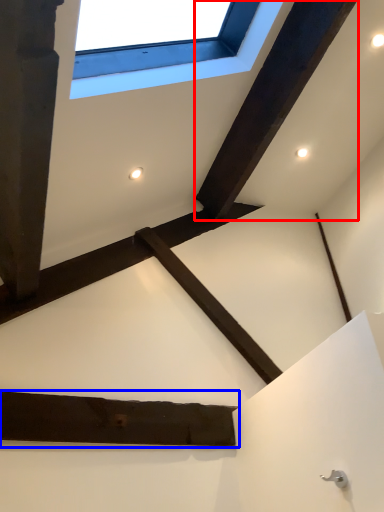
Question: Which object appears farthest to the camera in this image, plank (highlighted by a red box) or plank (highlighted by a blue box)?

Choices:
 (A) plank
 (B) plank

Answer: (A)